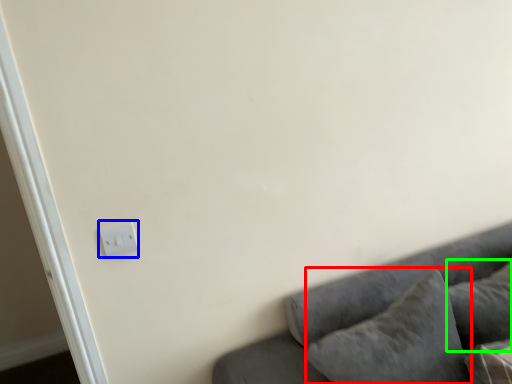
Question: Which is nearer to the pillow (highlighted by a red box)? light switch (highlighted by a blue box) or pillow (highlighted by a green box).

Choices:
 (A) light switch
 (B) pillow

Answer: (B)